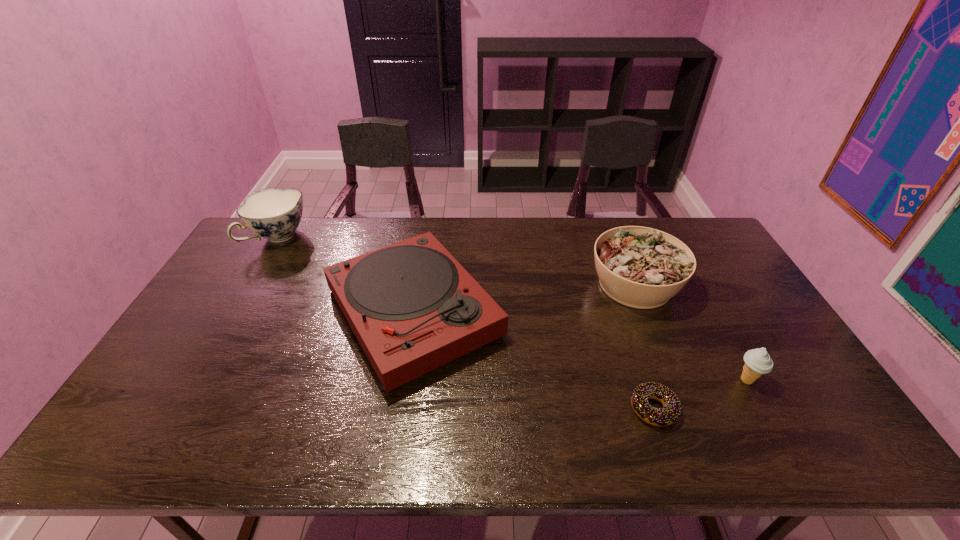
Image resolution: width=960 pixels, height=540 pixels. Identify the location of vacant space at the right edge of the desktop. (761, 323).

In the image, there is a desktop. Find the location of `free region at the far right corner`. free region at the far right corner is located at coordinates (689, 241).

The width and height of the screenshot is (960, 540). I want to click on free space between the icecream and the salad, so click(691, 332).

Image resolution: width=960 pixels, height=540 pixels. What are the coordinates of `vacant region between the icecream and the leftmost object` in the screenshot? It's located at (513, 309).

The height and width of the screenshot is (540, 960). Find the location of `vacant area that lies between the shortest object and the fourth object from right to left`. vacant area that lies between the shortest object and the fourth object from right to left is located at coordinates (534, 361).

The width and height of the screenshot is (960, 540). I want to click on free point between the doughnut and the salad, so click(x=644, y=347).

You are a GUI agent. You are given a task and a screenshot of the screen. Output one action in this format:
    pyautogui.click(x=<x>, y=<y>)
    Task: Click on the free space that is in between the second object from left to right and the salad
    The width and height of the screenshot is (960, 540).
    Given the screenshot: What is the action you would take?
    pyautogui.click(x=524, y=299)

Locate an element on the screen. The image size is (960, 540). free space between the second object from left to right and the icecream is located at coordinates (580, 347).

This screenshot has width=960, height=540. Identify the location of vacant area that lies between the shortest object and the record player. tap(534, 361).

Locate an element on the screen. The width and height of the screenshot is (960, 540). object that stands as the third closest to the icecream is located at coordinates (411, 305).